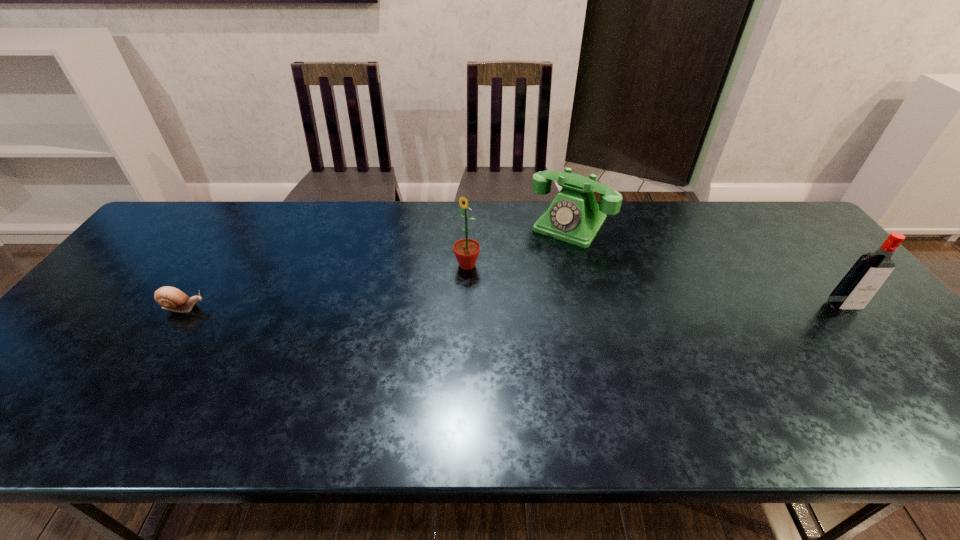
Locate an element on the screen. This screenshot has height=540, width=960. vacant area that lies between the third object from left to right and the rightmost object is located at coordinates (707, 266).

The height and width of the screenshot is (540, 960). I want to click on object that ranks as the second closest to the rightmost object, so click(466, 251).

This screenshot has width=960, height=540. Identify the location of the second closest object to the rightmost object. (466, 251).